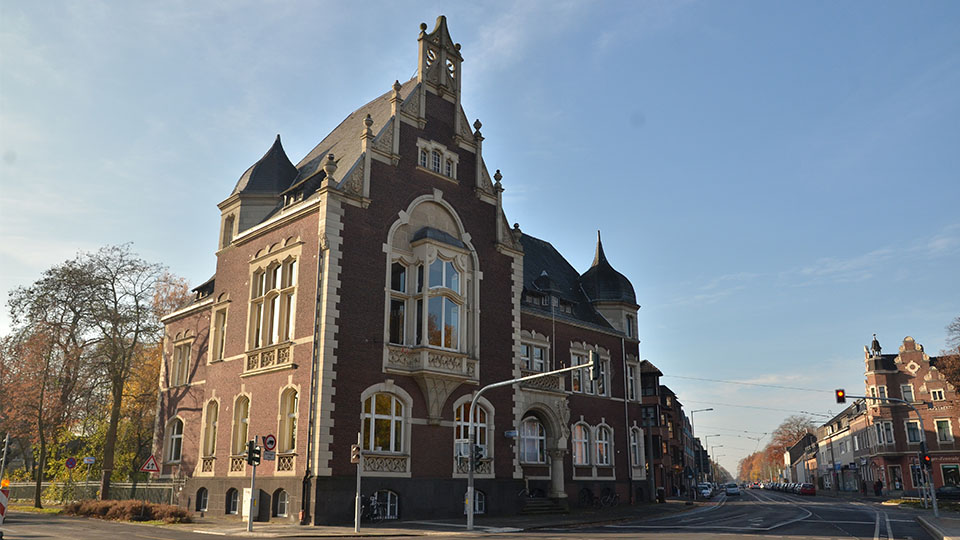
Locate an element on the screen. Image resolution: width=960 pixels, height=540 pixels. basement window is located at coordinates (483, 507), (277, 504), (388, 500), (229, 496), (199, 495).